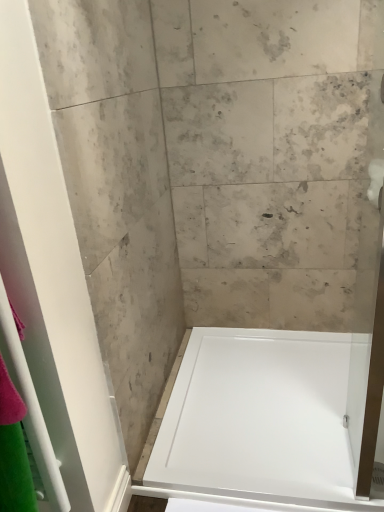
Question: Considering the relative sizes of white glossy bathtub at center and white glossy shower door at left in the image provided, is white glossy bathtub at center bigger than white glossy shower door at left?

Choices:
 (A) no
 (B) yes

Answer: (B)

Question: From a real-world perspective, is white glossy bathtub at center located higher than white glossy shower door at left?

Choices:
 (A) yes
 (B) no

Answer: (B)

Question: Would you say white glossy bathtub at center contains white glossy shower door at left?

Choices:
 (A) no
 (B) yes

Answer: (A)

Question: Is white glossy bathtub at center placed right next to white glossy shower door at left?

Choices:
 (A) yes
 (B) no

Answer: (B)

Question: Does white glossy bathtub at center come in front of white glossy shower door at left?

Choices:
 (A) no
 (B) yes

Answer: (A)

Question: From the image's perspective, is white matte toilet paper at upper right above or below white glossy bathtub at center?

Choices:
 (A) above
 (B) below

Answer: (A)

Question: Considering their positions, is white matte toilet paper at upper right located in front of or behind white glossy bathtub at center?

Choices:
 (A) behind
 (B) front

Answer: (B)

Question: Looking at the image, does white matte toilet paper at upper right seem bigger or smaller compared to white glossy bathtub at center?

Choices:
 (A) small
 (B) big

Answer: (A)

Question: From a real-world perspective, is white matte toilet paper at upper right physically located above or below white glossy bathtub at center?

Choices:
 (A) below
 (B) above

Answer: (B)

Question: In terms of height, does white glossy bathtub at center look taller or shorter compared to white glossy shower door at left?

Choices:
 (A) tall
 (B) short

Answer: (B)

Question: Is white glossy bathtub at center to the left or to the right of white glossy shower door at left in the image?

Choices:
 (A) left
 (B) right

Answer: (B)

Question: From the image's perspective, relative to white glossy shower door at left, is white glossy bathtub at center above or below?

Choices:
 (A) below
 (B) above

Answer: (A)

Question: Considering the positions of white glossy bathtub at center and white glossy shower door at left in the image, is white glossy bathtub at center bigger or smaller than white glossy shower door at left?

Choices:
 (A) big
 (B) small

Answer: (A)

Question: Considering the positions of point (120, 468) and point (377, 198), is point (120, 468) closer or farther from the camera than point (377, 198)?

Choices:
 (A) farther
 (B) closer

Answer: (B)

Question: In terms of width, does white glossy shower door at left look wider or thinner when compared to white matte toilet paper at upper right?

Choices:
 (A) thin
 (B) wide

Answer: (A)